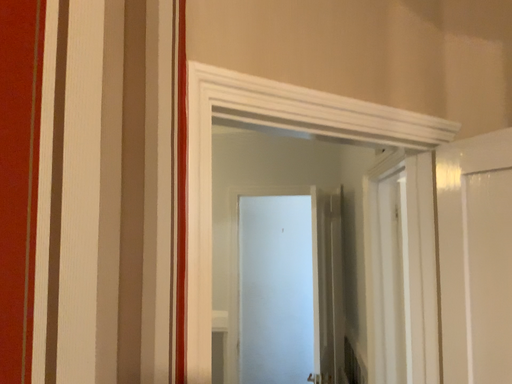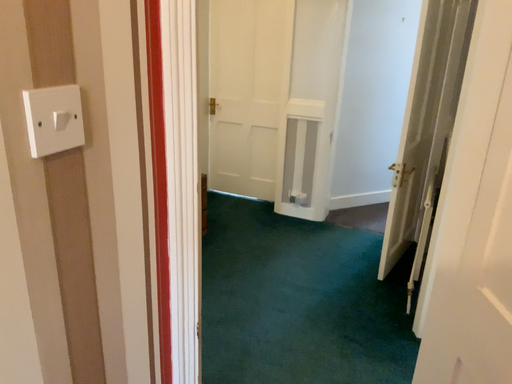
Question: How did the camera likely rotate when shooting the video?

Choices:
 (A) rotated upward
 (B) rotated downward

Answer: (B)